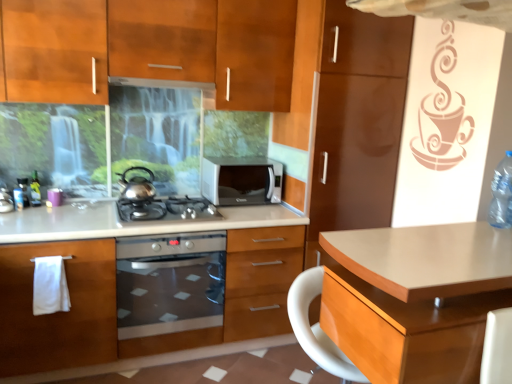
What are the coordinates of `vacant space in front of satin silver microwave at center` in the screenshot? It's located at (251, 215).